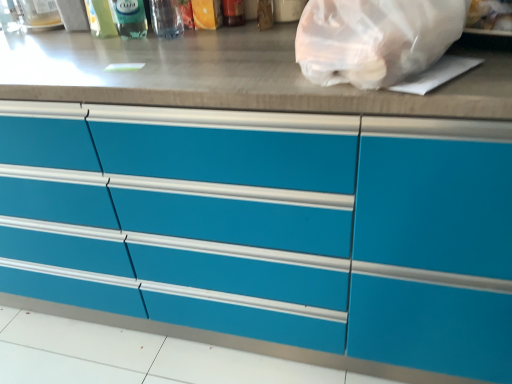
Locate an element on the screen. vacant space to the left of transparent plastic bottle at upper center, marked as the 1th bottle in a right-to-left arrangement is located at coordinates (108, 43).